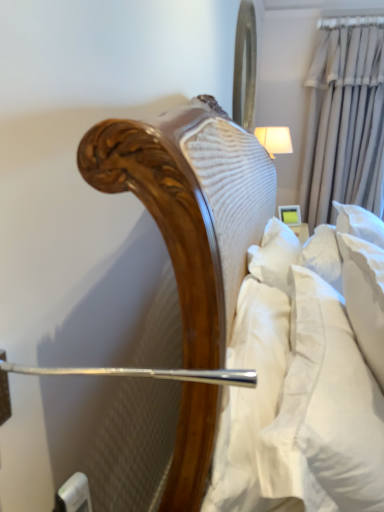
Question: From a real-world perspective, is beige fabric curtain at upper right physically above white soft pillow at right?

Choices:
 (A) no
 (B) yes

Answer: (B)

Question: Is beige fabric curtain at upper right at the right side of white soft pillow at right?

Choices:
 (A) yes
 (B) no

Answer: (A)

Question: Is beige fabric curtain at upper right looking in the opposite direction of white soft pillow at right?

Choices:
 (A) no
 (B) yes

Answer: (A)

Question: Is beige fabric curtain at upper right smaller than white soft pillow at right?

Choices:
 (A) yes
 (B) no

Answer: (B)

Question: Is beige fabric curtain at upper right taller than white soft pillow at right?

Choices:
 (A) no
 (B) yes

Answer: (B)

Question: Considering the positions of white fabric lampshade at upper right and beige fabric curtain at upper right in the image, is white fabric lampshade at upper right taller or shorter than beige fabric curtain at upper right?

Choices:
 (A) tall
 (B) short

Answer: (B)

Question: From the image's perspective, relative to beige fabric curtain at upper right, is white fabric lampshade at upper right above or below?

Choices:
 (A) below
 (B) above

Answer: (A)

Question: Is white fabric lampshade at upper right situated inside beige fabric curtain at upper right or outside?

Choices:
 (A) outside
 (B) inside

Answer: (A)

Question: Does point (276, 153) appear closer or farther from the camera than point (326, 212)?

Choices:
 (A) closer
 (B) farther

Answer: (A)

Question: Is white fabric lampshade at upper right in front of or behind white soft pillow at right in the image?

Choices:
 (A) behind
 (B) front

Answer: (A)

Question: From the image's perspective, relative to white soft pillow at right, is white fabric lampshade at upper right above or below?

Choices:
 (A) above
 (B) below

Answer: (A)

Question: Is point (256, 131) closer or farther from the camera than point (377, 394)?

Choices:
 (A) farther
 (B) closer

Answer: (A)

Question: Visually, is white fabric lampshade at upper right positioned to the left or to the right of white soft pillow at right?

Choices:
 (A) right
 (B) left

Answer: (A)

Question: From a real-world perspective, relative to beige fabric curtain at upper right, is metallic reflective mirror at upper center vertically above or below?

Choices:
 (A) above
 (B) below

Answer: (A)

Question: Considering the positions of metallic reflective mirror at upper center and beige fabric curtain at upper right in the image, is metallic reflective mirror at upper center taller or shorter than beige fabric curtain at upper right?

Choices:
 (A) short
 (B) tall

Answer: (A)